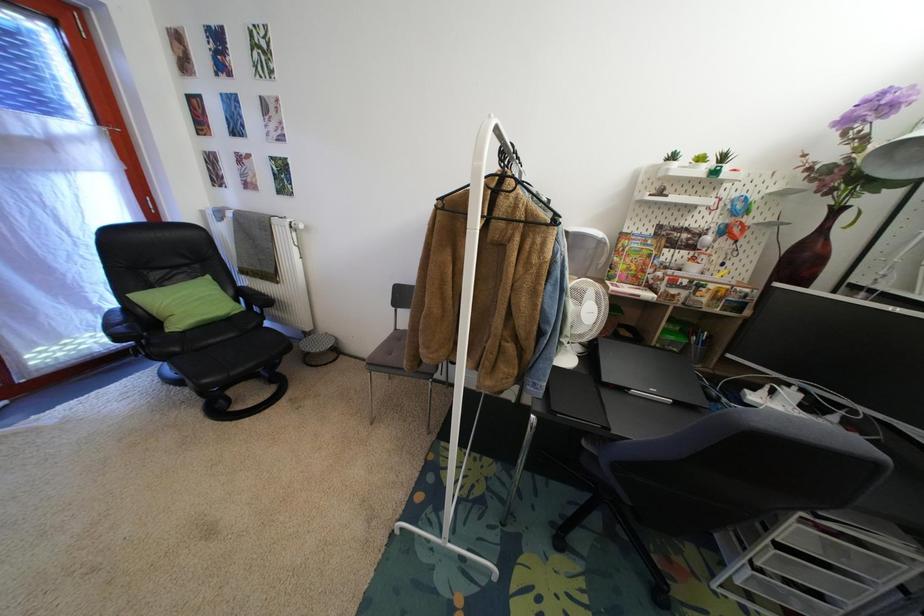
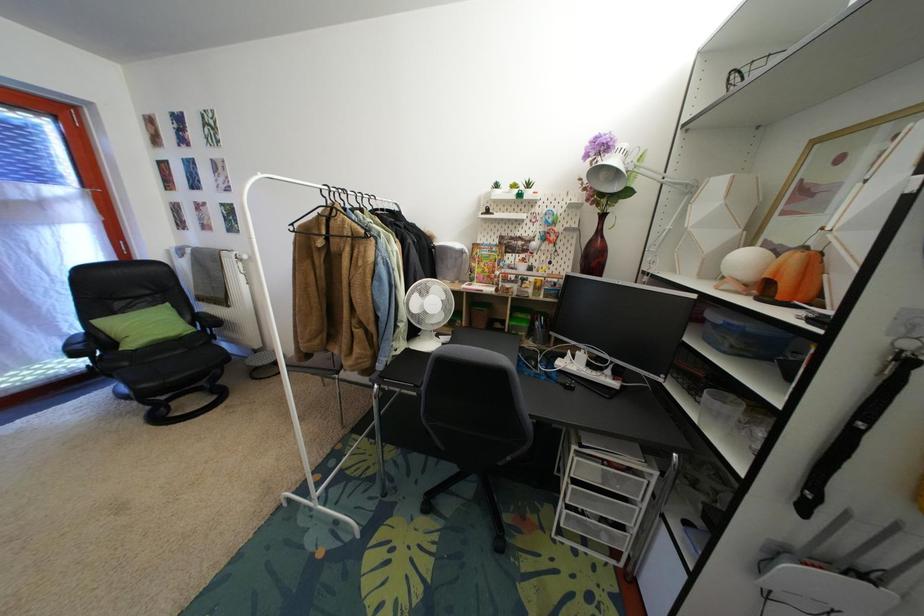
Question: How did the camera likely rotate?

Choices:
 (A) Left
 (B) Right
 (C) Up
 (D) Down

Answer: (C)